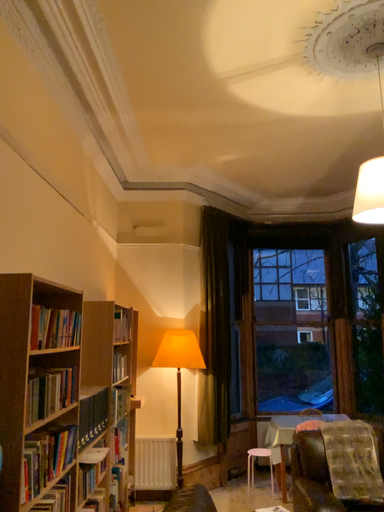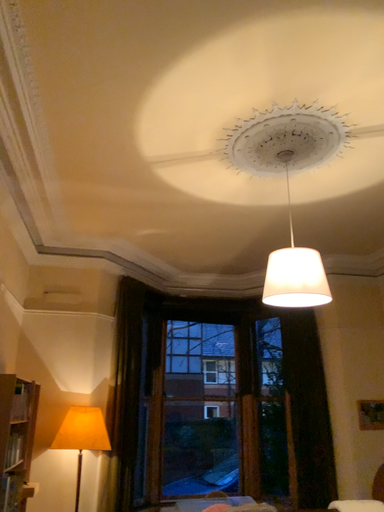
Question: How did the camera likely rotate when shooting the video?

Choices:
 (A) rotated upward
 (B) rotated downward

Answer: (A)